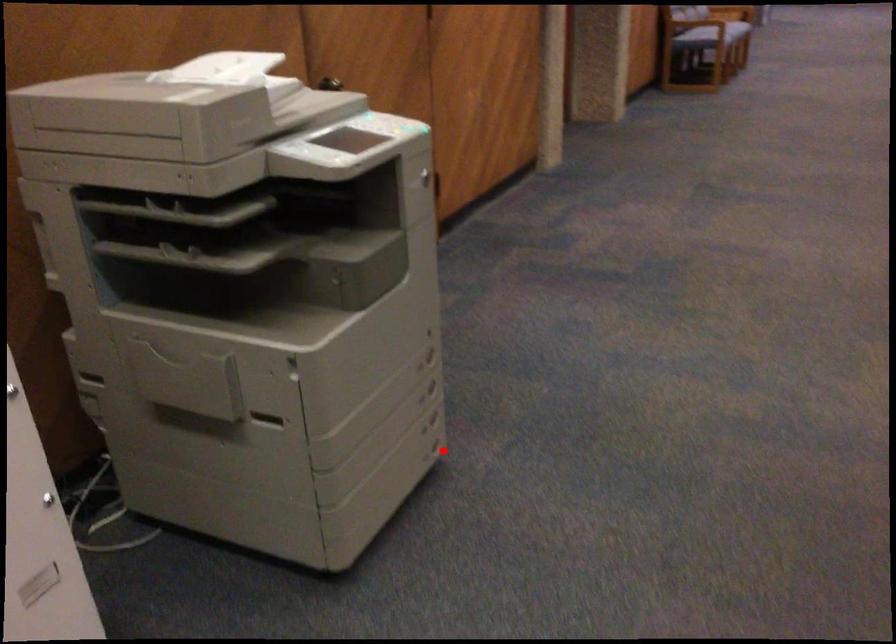
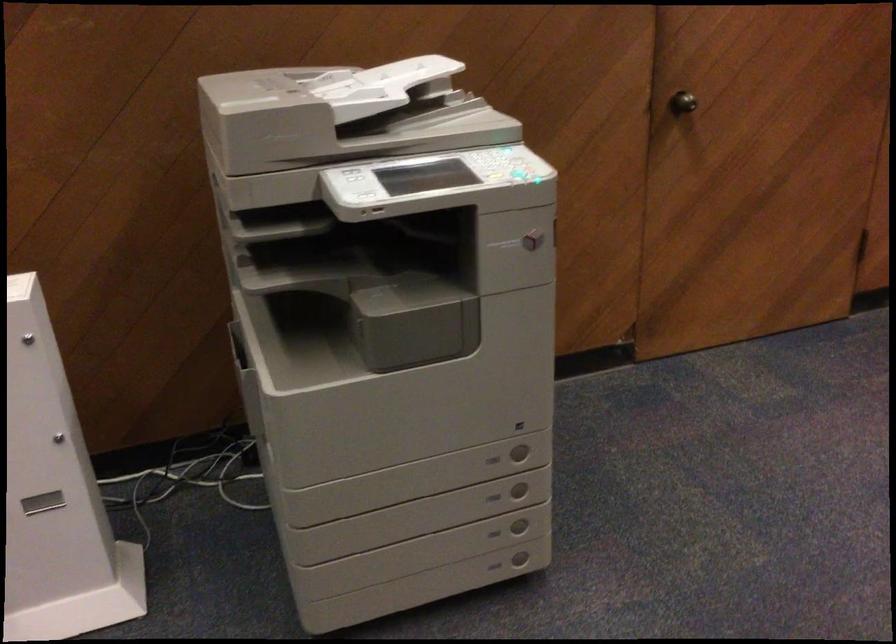
Question: A red point is marked in image1. In image2, is the corresponding 3D point closer to the camera or farther? Reply with the corresponding letter.

Choices:
 (A) The corresponding 3D point is closer.
 (B) The corresponding 3D point is farther.

Answer: (A)